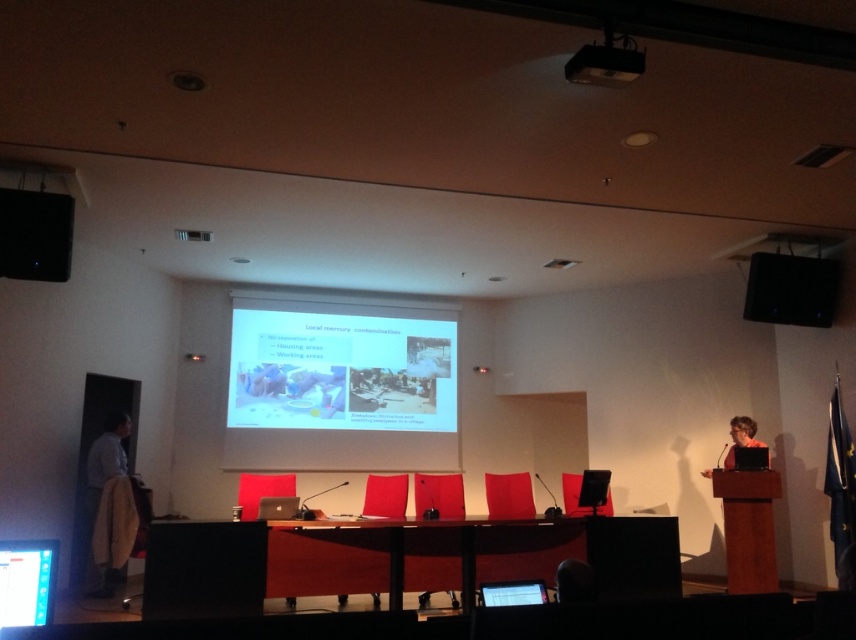
Question: Can you confirm if light brown fabric coat at left is positioned to the right of black plastic projector at upper center?

Choices:
 (A) no
 (B) yes

Answer: (A)

Question: Which of these objects is positioned farthest from the wooden table at center?

Choices:
 (A) matte black laptop at right
 (B) light brown fabric coat at left
 (C) black plastic speaker at upper right

Answer: (B)

Question: Which point is farther to the camera?

Choices:
 (A) light brown fabric coat at left
 (B) black matte speaker at upper left

Answer: (A)

Question: Is black matte speaker at upper left in front of light brown fabric coat at left?

Choices:
 (A) yes
 (B) no

Answer: (A)

Question: Which point is farther from the camera taking this photo?

Choices:
 (A) (189, 544)
 (B) (619, 58)
 (C) (524, 600)
 (D) (345, 326)

Answer: (D)

Question: Does wooden table at center have a lesser width compared to black matte speaker at upper left?

Choices:
 (A) yes
 (B) no

Answer: (B)